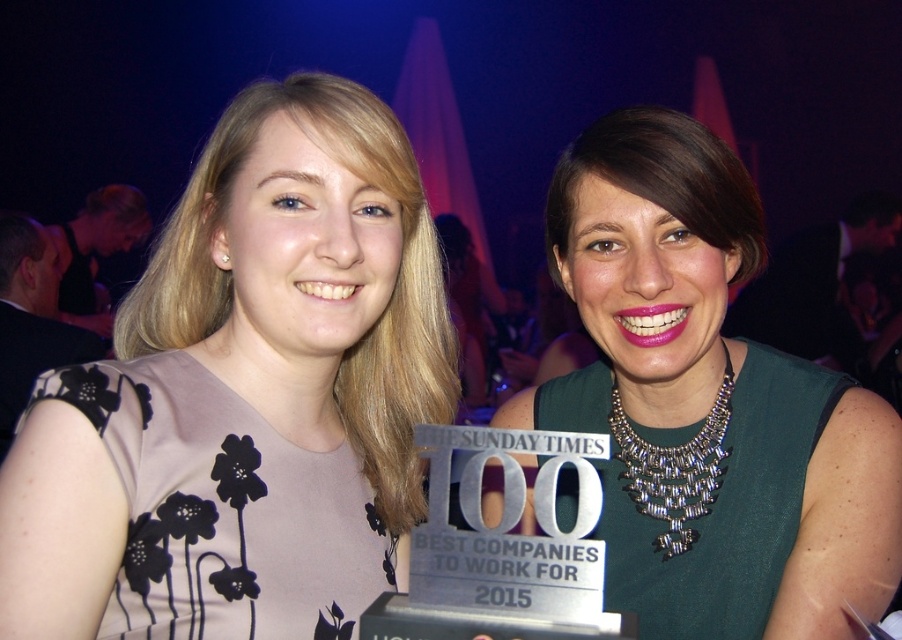
You are a photographer at the event and need to ensure both the pink matte dress at center and the silver metallic necklace at upper center are clearly visible in the photo. Given their sizes, which one might require more careful framing to avoid being too small in the shot?

The silver metallic necklace at upper center is smaller than the pink matte dress at center, so it might require more careful framing to ensure it is not too small in the photo.

You are a photographer trying to capture a closeup of the pink matte dress at center and the green metallic necklace at center. Based on the distance between them, can you fit both into your camera frame which has a maximum width of 12 inches?

The distance between the pink matte dress at center and the green metallic necklace at center is 13.59 inches, which exceeds the camera frame width of 12 inches. Therefore, both cannot fit within the frame simultaneously.

You are a photographer at the event and want to capture a closeup of the green metallic necklace at center and the silver metallic necklace at upper center. Which necklace is positioned higher in the image?

The green metallic necklace at center is located above the silver metallic necklace at upper center, so the green metallic necklace at center is positioned higher in the image.